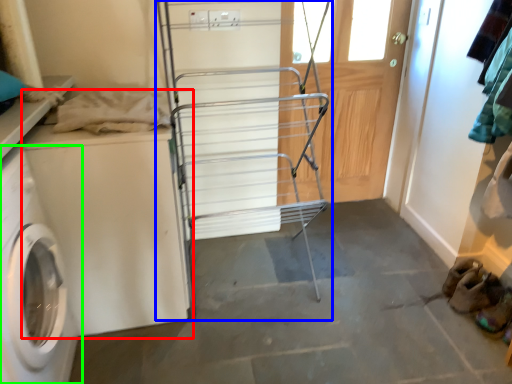
Question: Based on their relative distances, which object is nearer to washing machine (highlighted by a red box)? Choose from trolley (highlighted by a blue box) and washing machine (highlighted by a green box).

Choices:
 (A) trolley
 (B) washing machine

Answer: (B)